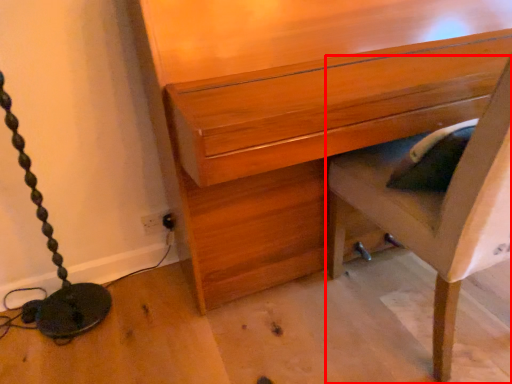
Question: Considering the relative positions of furniture (annotated by the red box) and chest of drawers in the image provided, where is furniture (annotated by the red box) located with respect to the staircase?

Choices:
 (A) right
 (B) left

Answer: (A)